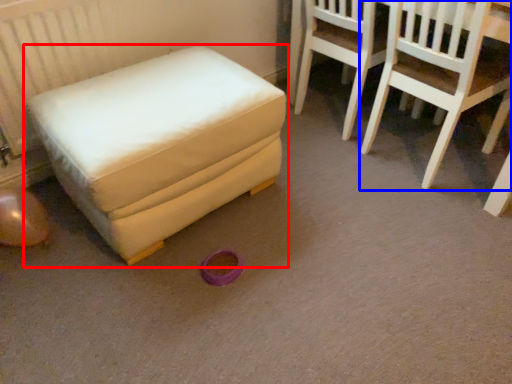
Question: Which object is closer to the camera taking this photo, furniture (highlighted by a red box) or chair (highlighted by a blue box)?

Choices:
 (A) furniture
 (B) chair

Answer: (A)